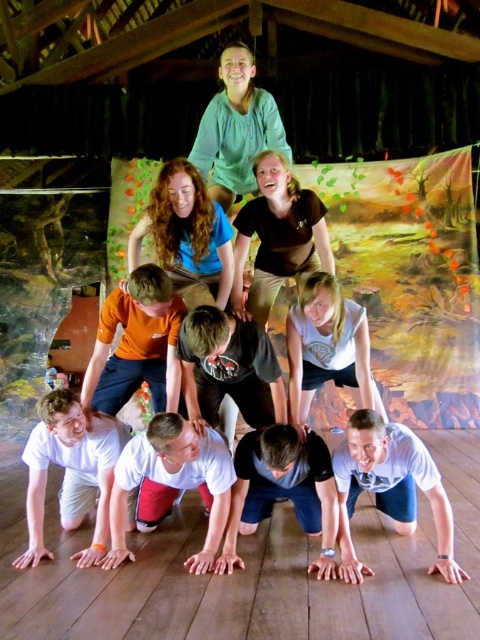
You are standing at the camera position and want to place a small flag exactly at point (170, 323). If you throw the flag straight ahead, will it land at the point?

The point (170, 323) is 9.17 feet away from the camera. Since you are throwing the flag straight ahead from the camera position, it will land at the point (170, 323).